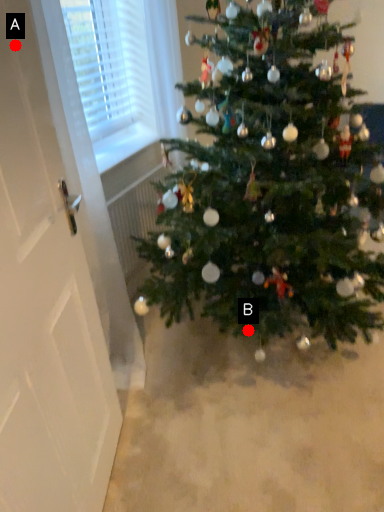
Question: Two points are circled on the image, labeled by A and B beside each circle. Which point is farther from the camera taking this photo?

Choices:
 (A) A is further
 (B) B is further

Answer: (B)